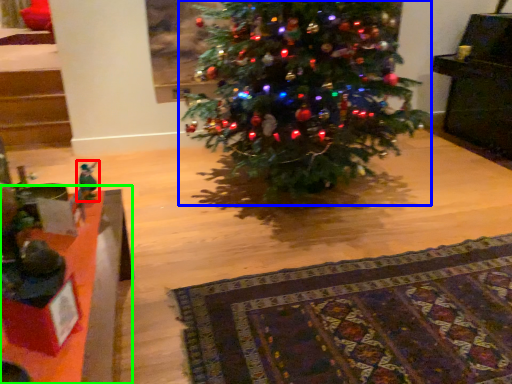
Question: Estimate the real-world distances between objects in this image. Which object is farther from toy (highlighted by a red box), christmas tree (highlighted by a blue box) or table (highlighted by a green box)?

Choices:
 (A) christmas tree
 (B) table

Answer: (A)